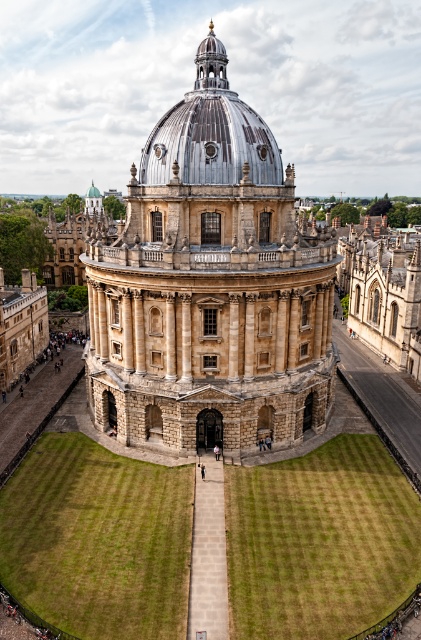
You are standing at the entrance of the building and want to walk directly towards the golden stone dome at center. Based on the coordinates provided, in which direction should you move relative to your current position?

The golden stone dome at center is located at coordinates point (x=210, y=285), so you should move forward since it is directly ahead of you.

You are an architect planning to install a new lighting system between the golden stone dome at center and the shiny silver dome at center. The system requires a minimum distance of 10 meters between fixtures. Can you place two fixtures between them without violating this requirement?

The golden stone dome at center and shiny silver dome at center are 11.48 meters apart. Since the required minimum distance between fixtures is 10 meters, placing two fixtures between them would be possible as the distance exceeds the requirement.